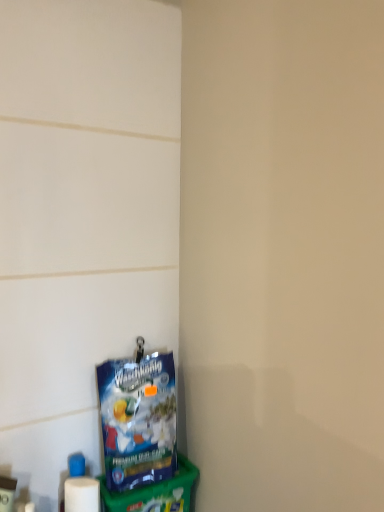
Find the location of a particular element. This screenshot has width=384, height=512. white plastic container at lower left is located at coordinates (7, 493).

Image resolution: width=384 pixels, height=512 pixels. What do you see at coordinates (7, 493) in the screenshot? I see `white plastic container at lower left` at bounding box center [7, 493].

The height and width of the screenshot is (512, 384). Describe the element at coordinates (138, 419) in the screenshot. I see `blue plastic bag at lower left` at that location.

The height and width of the screenshot is (512, 384). Identify the location of blue plastic bag at lower left. (138, 419).

In order to face blue plastic bag at lower left, should I rotate leftwards or rightwards?

You should look left and rotate roughly 6.204 degrees.

Locate an element on the screen. The image size is (384, 512). white plastic container at lower left is located at coordinates (7, 493).

Which object is positioned more to the left, blue plastic bag at lower left or white plastic container at lower left?

From the viewer's perspective, white plastic container at lower left appears more on the left side.

Which object is closer to the camera, blue plastic bag at lower left or white plastic container at lower left?

white plastic container at lower left is more forward.

Considering the points (161, 402) and (5, 479), which point is behind, point (161, 402) or point (5, 479)?

The point (161, 402) is farther from the camera.

From the image's perspective, between blue plastic bag at lower left and white plastic container at lower left, which one is located above?

blue plastic bag at lower left appears higher in the image.

From a real-world perspective, who is located lower, blue plastic bag at lower left or white plastic container at lower left?

white plastic container at lower left, from a real-world perspective.

Considering the sizes of blue plastic bag at lower left and white plastic container at lower left in the image, is blue plastic bag at lower left wider or thinner than white plastic container at lower left?

Clearly, blue plastic bag at lower left has more width compared to white plastic container at lower left.

Considering the relative sizes of blue plastic bag at lower left and white plastic container at lower left in the image provided, is blue plastic bag at lower left shorter than white plastic container at lower left?

No, blue plastic bag at lower left is not shorter than white plastic container at lower left.

Who is bigger, blue plastic bag at lower left or white plastic container at lower left?

With larger size is blue plastic bag at lower left.

From the picture: Is blue plastic bag at lower left completely or partially outside of white plastic container at lower left?

Yes, blue plastic bag at lower left is outside of white plastic container at lower left.

Would you consider blue plastic bag at lower left to be distant from white plastic container at lower left?

No, there isn't a large distance between blue plastic bag at lower left and white plastic container at lower left.

Could you tell me if blue plastic bag at lower left is turned towards white plastic container at lower left?

No, blue plastic bag at lower left is not turned towards white plastic container at lower left.

Locate an element on the screen. toy that is above the white plastic container at lower left (from the image's perspective) is located at coordinates pos(138,419).

Considering the positions of objects white plastic container at lower left and blue plastic bag at lower left in the image provided, who is more to the left, white plastic container at lower left or blue plastic bag at lower left?

white plastic container at lower left is more to the left.

Based on the photo, does white plastic container at lower left lie behind blue plastic bag at lower left?

No, white plastic container at lower left is closer to the camera.

Which is less distant, (6, 509) or (139, 356)?

Point (6, 509) is closer to the camera than point (139, 356).

From the image's perspective, which one is positioned lower, white plastic container at lower left or blue plastic bag at lower left?

white plastic container at lower left is shown below in the image.

From a real-world perspective, is white plastic container at lower left on blue plastic bag at lower left?

No, from a real-world perspective, white plastic container at lower left is not over blue plastic bag at lower left

Is white plastic container at lower left thinner than blue plastic bag at lower left?

Yes.

Considering the relative sizes of white plastic container at lower left and blue plastic bag at lower left in the image provided, is white plastic container at lower left shorter than blue plastic bag at lower left?

Yes, white plastic container at lower left is shorter than blue plastic bag at lower left.

Does white plastic container at lower left have a larger size compared to blue plastic bag at lower left?

Actually, white plastic container at lower left might be smaller than blue plastic bag at lower left.

Is blue plastic bag at lower left surrounded by white plastic container at lower left?

No, blue plastic bag at lower left is not surrounded by white plastic container at lower left.

Looking at this image, is white plastic container at lower left not near blue plastic bag at lower left?

That's not correct — white plastic container at lower left is a little close to blue plastic bag at lower left.

Is white plastic container at lower left turned away from blue plastic bag at lower left?

No, white plastic container at lower left is not facing away from blue plastic bag at lower left.

How different are the orientations of white plastic container at lower left and blue plastic bag at lower left in degrees?

There is a 25-degree angle between the facing directions of white plastic container at lower left and blue plastic bag at lower left.

Find the location of a particular element. The image size is (384, 512). toiletry below the blue plastic bag at lower left (from a real-world perspective) is located at coordinates pyautogui.click(x=7, y=493).

Identify the location of toy above the white plastic container at lower left (from the image's perspective). The image size is (384, 512). (138, 419).

The height and width of the screenshot is (512, 384). In order to click on toy behind the white plastic container at lower left in this screenshot , I will do `click(138, 419)`.